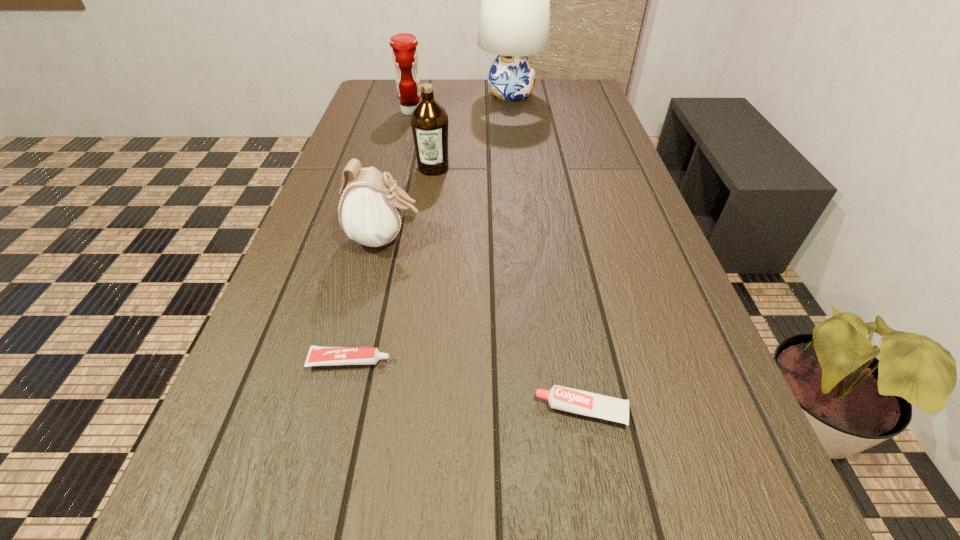
Locate an element on the screen. Image resolution: width=960 pixels, height=540 pixels. vacant area between the nearer toothpaste and the pouch is located at coordinates click(484, 325).

I want to click on free space between the right toothpaste and the third nearest object, so click(x=484, y=325).

Locate an element on the screen. empty location between the fourth nearest object and the farther toothpaste is located at coordinates (392, 264).

Where is `vacant area between the tallest object and the right toothpaste`? The image size is (960, 540). vacant area between the tallest object and the right toothpaste is located at coordinates (546, 252).

Locate an element on the screen. The height and width of the screenshot is (540, 960). free space between the fourth nearest object and the lampshade is located at coordinates (472, 131).

Locate an element on the screen. This screenshot has width=960, height=540. vacant space that is in between the lampshade and the nearer toothpaste is located at coordinates (546, 252).

Locate an element on the screen. The height and width of the screenshot is (540, 960). blank region between the condiment and the nearest object is located at coordinates (496, 261).

Locate an element on the screen. The height and width of the screenshot is (540, 960). the closest object to the pouch is located at coordinates (429, 121).

Select which object is the fourth closest to the lampshade. Please provide its 2D coordinates. Your answer should be formatted as a tuple, i.e. [(x, y)], where the tuple contains the x and y coordinates of a point satisfying the conditions above.

[(318, 356)]

Identify the location of blank space that satisfies the following two spatial constraints: 1. on the front-facing side of the pouch; 2. on the left side of the nearest object. The width and height of the screenshot is (960, 540). tap(346, 410).